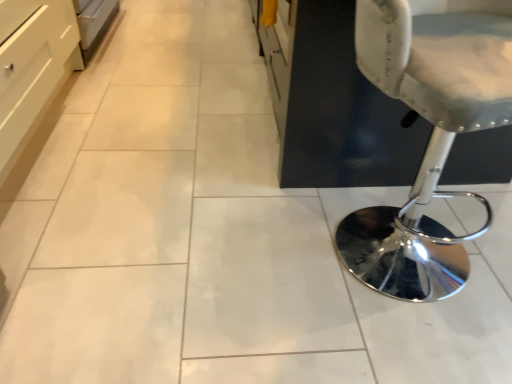
Describe the element at coordinates (430, 139) in the screenshot. I see `white leather stool at right` at that location.

This screenshot has height=384, width=512. Identify the location of white leather stool at right. (430, 139).

Identify the location of white glossy drawer at left. The width and height of the screenshot is (512, 384). (32, 68).

What do you see at coordinates (32, 68) in the screenshot?
I see `white glossy drawer at left` at bounding box center [32, 68].

I want to click on white leather stool at right, so click(430, 139).

In the scene shown: Can you confirm if white leather stool at right is positioned to the right of white glossy drawer at left?

Yes.

Is the depth of white leather stool at right less than that of white glossy drawer at left?

Yes, white leather stool at right is closer to the camera.

Which point is more distant from viewer, (366,14) or (54,70)?

Point (54,70)

From the image's perspective, is white leather stool at right over white glossy drawer at left?

Incorrect, from the image's perspective, white leather stool at right is lower than white glossy drawer at left.

From a real-world perspective, is white leather stool at right above or below white glossy drawer at left?

white leather stool at right is above white glossy drawer at left.

Is white leather stool at right wider than white glossy drawer at left?

Indeed, white leather stool at right has a greater width compared to white glossy drawer at left.

Is white leather stool at right taller than white glossy drawer at left?

Yes.

Does white leather stool at right have a larger size compared to white glossy drawer at left?

Actually, white leather stool at right might be smaller than white glossy drawer at left.

Is white leather stool at right spatially inside white glossy drawer at left, or outside of it?

white leather stool at right exists outside the volume of white glossy drawer at left.

Looking at this image, can you see white leather stool at right touching white glossy drawer at left?

No, white leather stool at right is not beside white glossy drawer at left.

Is white leather stool at right facing away from white glossy drawer at left?

That's not correct — white leather stool at right is not looking away from white glossy drawer at left.

What's the angular difference between white leather stool at right and white glossy drawer at left's facing directions?

74.6 degrees separate the facing orientations of white leather stool at right and white glossy drawer at left.

Find the location of a particular element. The width and height of the screenshot is (512, 384). chair in front of the white glossy drawer at left is located at coordinates (430, 139).

Can you confirm if white glossy drawer at left is positioned to the right of white leather stool at right?

Incorrect, white glossy drawer at left is not on the right side of white leather stool at right.

Relative to white leather stool at right, is white glossy drawer at left in front or behind?

In the image, white glossy drawer at left appears behind white leather stool at right.

Is point (25, 105) positioned behind point (495, 67)?

Yes.

Consider the image. From the image's perspective, is white glossy drawer at left over white leather stool at right?

Yes, from the image's perspective, white glossy drawer at left is over white leather stool at right.

From a real-world perspective, is white glossy drawer at left above or below white leather stool at right?

In terms of real-world spatial position, white glossy drawer at left is below white leather stool at right.

In terms of width, does white glossy drawer at left look wider or thinner when compared to white leather stool at right?

Clearly, white glossy drawer at left has less width compared to white leather stool at right.

In terms of height, does white glossy drawer at left look taller or shorter compared to white leather stool at right?

Clearly, white glossy drawer at left is shorter compared to white leather stool at right.

Considering the relative sizes of white glossy drawer at left and white leather stool at right in the image provided, is white glossy drawer at left smaller than white leather stool at right?

Actually, white glossy drawer at left might be larger than white leather stool at right.

Is white glossy drawer at left positioned beyond the bounds of white leather stool at right?

Yes, white glossy drawer at left is not within white leather stool at right.

Would you say white glossy drawer at left is a long distance from white leather stool at right?

Yes.

Is white glossy drawer at left aimed at white leather stool at right?

Yes, white glossy drawer at left is oriented towards white leather stool at right.

I want to click on chair above the white glossy drawer at left (from a real-world perspective), so click(430, 139).

The width and height of the screenshot is (512, 384). Identify the location of drawer below the white leather stool at right (from a real-world perspective). (32, 68).

Find the location of a particular element. The width and height of the screenshot is (512, 384). drawer above the white leather stool at right (from the image's perspective) is located at coordinates (32, 68).